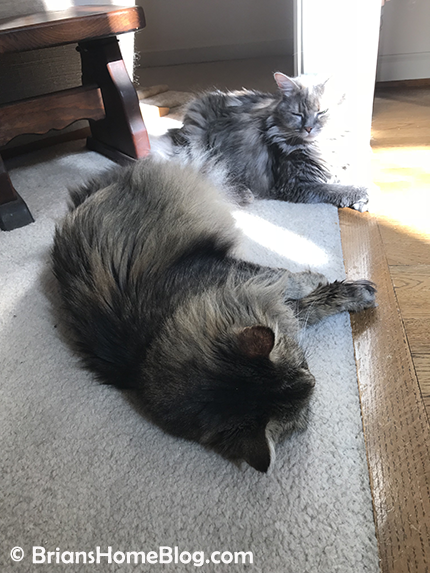
Where is `wooden floor`? This screenshot has width=430, height=573. wooden floor is located at coordinates (x=397, y=248).